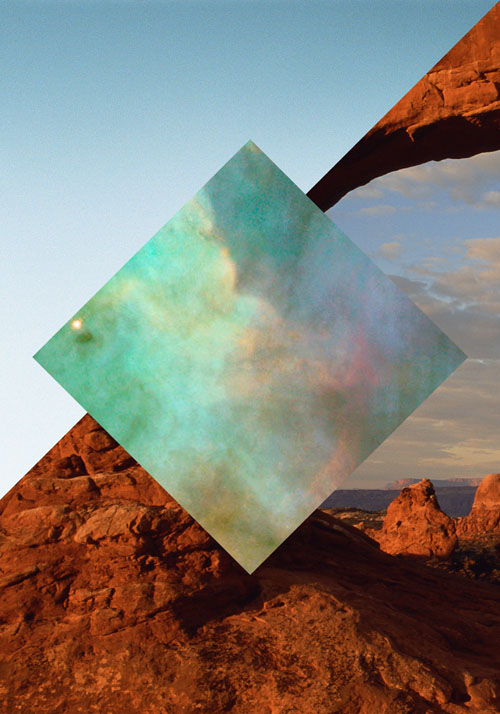
Image resolution: width=500 pixels, height=714 pixels. Identify the location of corners. (250, 570), (32, 353), (466, 353).